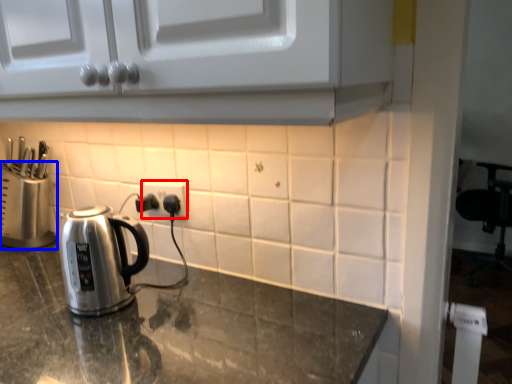
Question: Which of the following is the farthest to the observer, electric outlet (highlighted by a red box) or appliance (highlighted by a blue box)?

Choices:
 (A) electric outlet
 (B) appliance

Answer: (B)